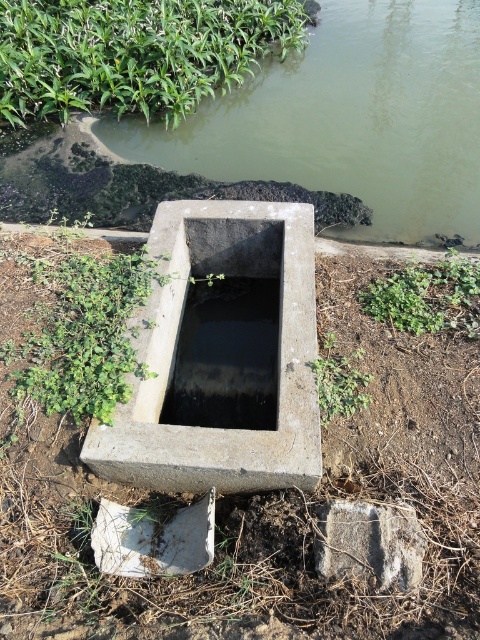
You are a gardener planning to plant a new shrub near the concrete rectangular at center and the green leafy plant at upper left. Considering their positions, where should you place the shrub to ensure it is between the two objects?

The shrub should be placed between the concrete rectangular at center and the green leafy plant at upper left, which is located above the concrete rectangular at center.

You are a gardener who wants to plant a new shrub in this area. Considering the green leafy plant at upper left and the black concrete puddle at center, which location would you choose for the shrub to ensure it has enough space to grow without being overshadowed?

The green leafy plant at upper left is much taller than the black concrete puddle at center, so planting the shrub near the black concrete puddle at center would provide more space for the shrub to grow without being overshadowed by the taller plant.